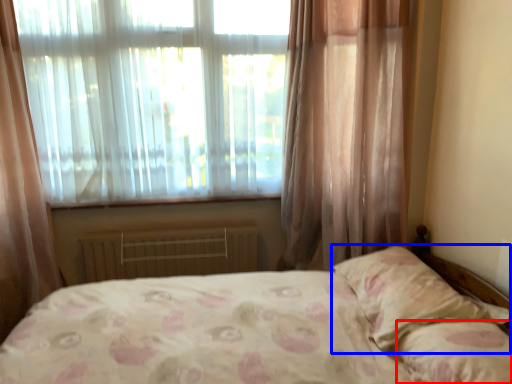
Question: Which of the following is the closest to the observer, pillow (highlighted by a red box) or pillow (highlighted by a blue box)?

Choices:
 (A) pillow
 (B) pillow

Answer: (A)